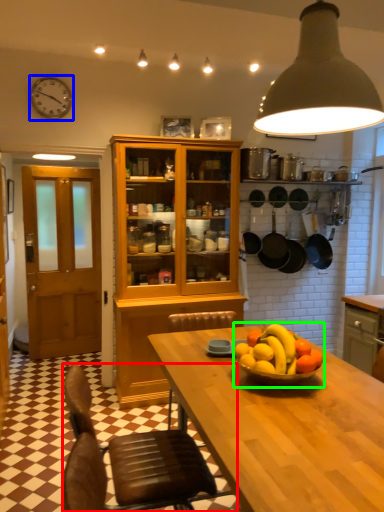
Question: Based on their relative distances, which object is nearer to chair (highlighted by a red box)? Choose from clock (highlighted by a blue box) and fruit dish (highlighted by a green box).

Choices:
 (A) clock
 (B) fruit dish

Answer: (B)